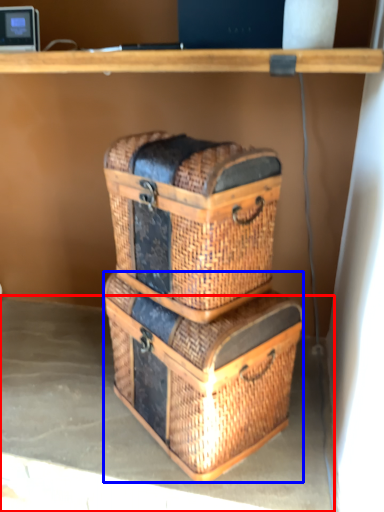
Question: Which point is closer to the camera, concrete (highlighted by a red box) or crate (highlighted by a blue box)?

Choices:
 (A) concrete
 (B) crate

Answer: (B)